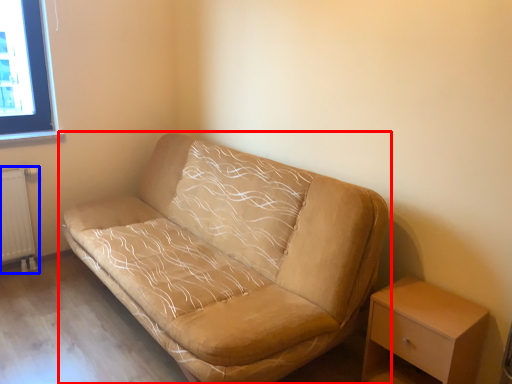
Question: Among these objects, which one is farthest to the camera, studio couch (highlighted by a red box) or radiator (highlighted by a blue box)?

Choices:
 (A) studio couch
 (B) radiator

Answer: (B)